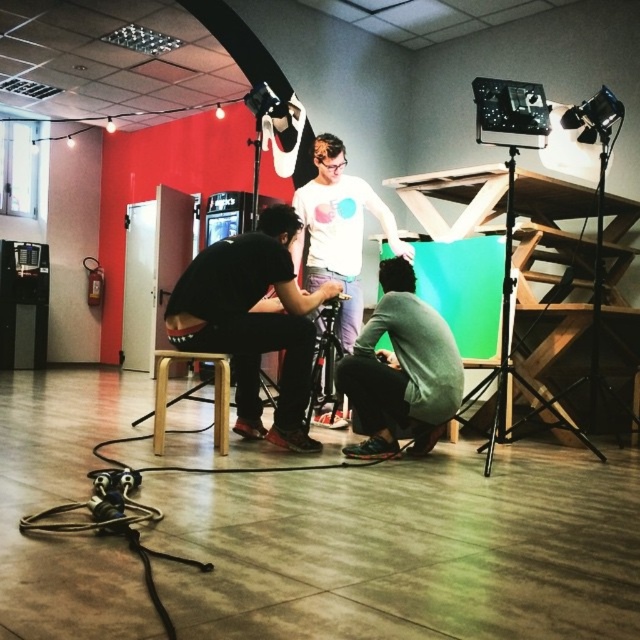
Is black matte stool at center wider than black metal tripod at upper right?

In fact, black matte stool at center might be narrower than black metal tripod at upper right.

Looking at this image, which is more to the right, black matte stool at center or black metal tripod at upper right?

black metal tripod at upper right

The height and width of the screenshot is (640, 640). Find the location of `black matte stool at center`. black matte stool at center is located at coordinates (252, 321).

Does gray fabric squat at lower right appear on the right side of white matte shirt at center?

Yes, gray fabric squat at lower right is to the right of white matte shirt at center.

Does point (404, 356) come farther from viewer compared to point (332, 202)?

No.

Image resolution: width=640 pixels, height=640 pixels. I want to click on gray fabric squat at lower right, so click(x=401, y=369).

Can you confirm if gray fabric squat at lower right is positioned below light brown wooden stool at center?

Incorrect, gray fabric squat at lower right is not positioned below light brown wooden stool at center.

Is gray fabric squat at lower right behind light brown wooden stool at center?

Yes, gray fabric squat at lower right is behind light brown wooden stool at center.

Is point (422, 372) in front of point (218, 355)?

Yes, it is in front of point (218, 355).

You are a GUI agent. You are given a task and a screenshot of the screen. Output one action in this format:
    pyautogui.click(x=<x>, y=<y>)
    Task: Click on the gray fabric squat at lower right
    This screenshot has height=640, width=640.
    Given the screenshot: What is the action you would take?
    pyautogui.click(x=401, y=369)